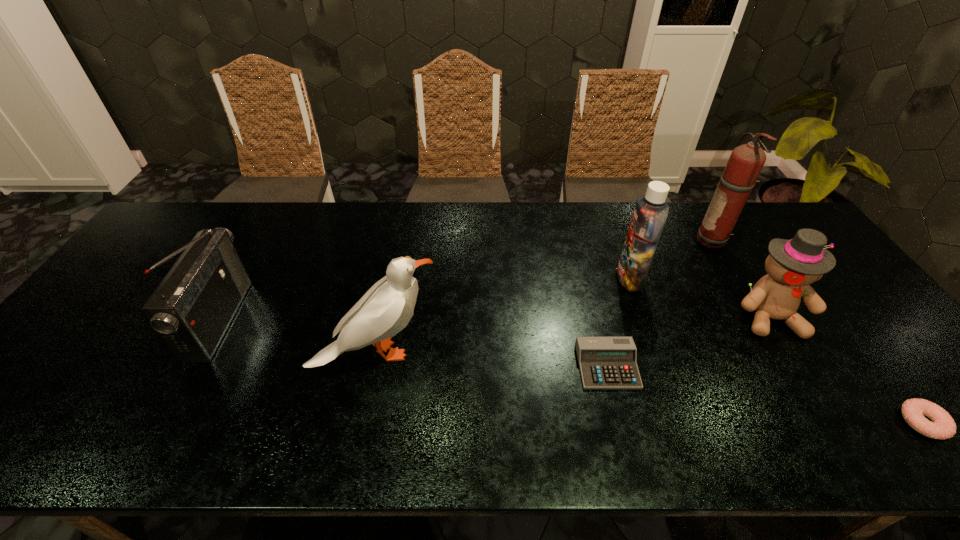
Locate an element on the screen. vacant space located on the front label of the shampoo is located at coordinates (579, 278).

Where is `vacant region located 0.080m on the front label of the shampoo`? vacant region located 0.080m on the front label of the shampoo is located at coordinates (589, 278).

I want to click on free space located on the front label of the shampoo, so click(x=586, y=278).

You are a GUI agent. You are given a task and a screenshot of the screen. Output one action in this format:
    pyautogui.click(x=<x>, y=<y>)
    Task: Click on the vacant space located 0.300m on the front-facing side of the leftmost object
    
    Given the screenshot: What is the action you would take?
    pyautogui.click(x=347, y=320)

The height and width of the screenshot is (540, 960). In order to click on free space located at the beak of the gull in this screenshot , I will do `click(569, 352)`.

At what (x,y) coordinates should I click in order to perform the action: click on vacant space located 0.230m on the front-facing side of the rag_doll. Please return your answer as a coordinate pair (x, y). This screenshot has width=960, height=540. Looking at the image, I should click on (836, 426).

At what (x,y) coordinates should I click in order to perform the action: click on vacant space located 0.360m on the left of the third object from left to right. Please return your answer as a coordinate pair (x, y). Looking at the image, I should click on (431, 366).

What are the coordinates of `object at the far edge` in the screenshot? It's located at (745, 163).

You are a GUI agent. You are given a task and a screenshot of the screen. Output one action in this format:
    pyautogui.click(x=<x>, y=<y>)
    Task: Click on the vacant space at the far edge of the desktop
    The width and height of the screenshot is (960, 540).
    Given the screenshot: What is the action you would take?
    pyautogui.click(x=404, y=205)

In the image, there is a desktop. Where is `free region at the near edge`? Image resolution: width=960 pixels, height=540 pixels. free region at the near edge is located at coordinates coord(250,419).